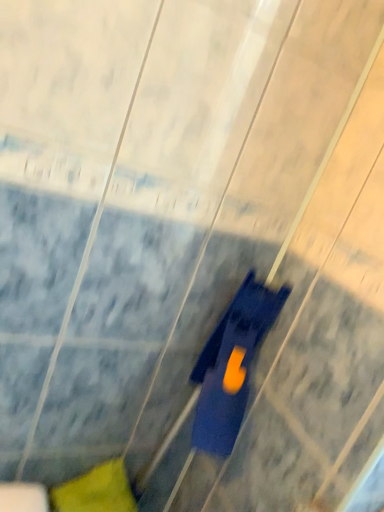
Find the location of a particular element. The width and height of the screenshot is (384, 512). yellow fabric towel at lower left is located at coordinates (96, 490).

What do you see at coordinates (96, 490) in the screenshot?
I see `yellow fabric towel at lower left` at bounding box center [96, 490].

What is the approximate width of yellow fabric towel at lower left?

5.70 inches.

Measure the distance between point (78, 485) and camera.

The distance of point (78, 485) from camera is 33.46 inches.

Find the location of a particular element. This screenshot has width=384, height=512. yellow fabric towel at lower left is located at coordinates (96, 490).